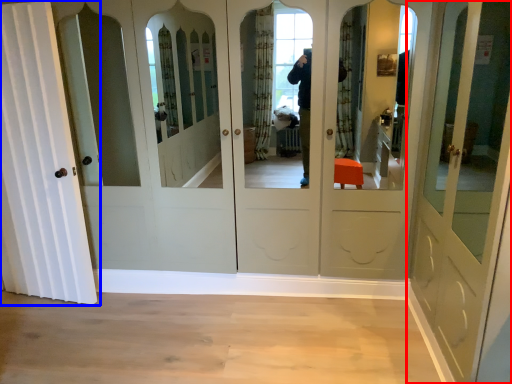
Question: Among these objects, which one is nearest to the camera, door (highlighted by a red box) or door (highlighted by a blue box)?

Choices:
 (A) door
 (B) door

Answer: (A)